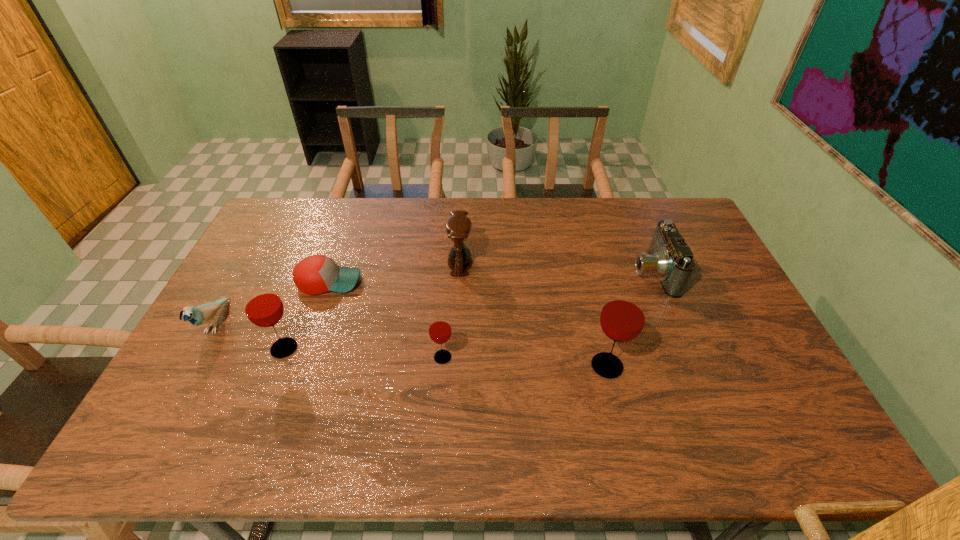
Find the location of `vacant point located 0.150m on the right of the rightmost glass`. vacant point located 0.150m on the right of the rightmost glass is located at coordinates (683, 366).

Image resolution: width=960 pixels, height=540 pixels. I want to click on vacant space located on the front-facing side of the rightmost object, so click(575, 272).

Identify the location of vacant space located on the front-facing side of the rightmost object. (551, 272).

Where is `vacant space located 0.100m on the front-facing side of the rightmost object`? Image resolution: width=960 pixels, height=540 pixels. vacant space located 0.100m on the front-facing side of the rightmost object is located at coordinates (600, 272).

Locate an element on the screen. This screenshot has width=960, height=540. free space located 0.210m at the brim of the shortest object is located at coordinates (427, 281).

At what (x,y) coordinates should I click in order to perform the action: click on free space located 0.050m at the face of the leftmost object. Please return your answer as a coordinate pair (x, y). The image size is (960, 540). Looking at the image, I should click on (192, 364).

Image resolution: width=960 pixels, height=540 pixels. What are the coordinates of `vacant space located on the right of the hourglass` in the screenshot? It's located at (584, 263).

The height and width of the screenshot is (540, 960). What are the coordinates of `object positioned at the near edge` in the screenshot? It's located at (622, 319).

At what (x,y) coordinates should I click in order to perform the action: click on object at the left edge. Please return your answer as a coordinate pair (x, y). Looking at the image, I should click on (202, 314).

At what (x,y) coordinates should I click in order to perform the action: click on object that is at the right edge. Please return your answer as a coordinate pair (x, y). Looking at the image, I should click on (670, 258).